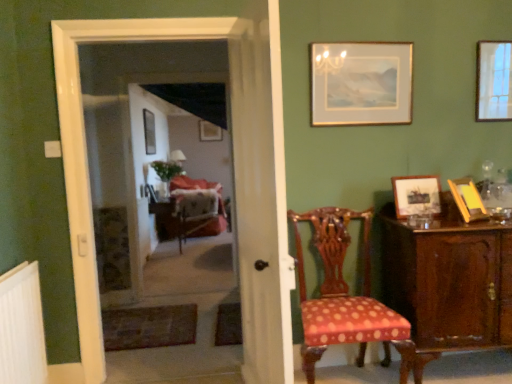
Question: Does metallic silver picture frame at center, which ranks as the 5th picture frame in front-to-back order, come behind matte gold picture frame at center, which appears as the fifth picture frame when viewed from the right?

Choices:
 (A) no
 (B) yes

Answer: (A)

Question: Is metallic silver picture frame at center, which ranks as the 5th picture frame in front-to-back order, facing away from matte gold picture frame at center, which appears as the fifth picture frame when viewed from the right?

Choices:
 (A) no
 (B) yes

Answer: (A)

Question: Can you confirm if metallic silver picture frame at center, which appears as the 6th picture frame when viewed from the right, is thinner than matte gold picture frame at center, placed as the second picture frame when sorted from left to right?

Choices:
 (A) no
 (B) yes

Answer: (A)

Question: Does metallic silver picture frame at center, which is counted as the first picture frame, starting from the left, have a lesser height compared to matte gold picture frame at center, positioned as the sixth picture frame in front-to-back order?

Choices:
 (A) no
 (B) yes

Answer: (A)

Question: Considering the relative sizes of metallic silver picture frame at center, which appears as the 6th picture frame when viewed from the right, and matte gold picture frame at center, which appears as the fifth picture frame when viewed from the right, in the image provided, is metallic silver picture frame at center, which appears as the 6th picture frame when viewed from the right, taller than matte gold picture frame at center, which appears as the fifth picture frame when viewed from the right,?

Choices:
 (A) no
 (B) yes

Answer: (B)

Question: From a real-world perspective, is metallic silver picture frame at center, which appears as the 6th picture frame when viewed from the right, physically below matte gold picture frame at center, placed as the second picture frame when sorted from left to right?

Choices:
 (A) no
 (B) yes

Answer: (B)

Question: Is white sheer curtain at center outside matte gold picture frame at center, placed as the second picture frame when sorted from left to right?

Choices:
 (A) yes
 (B) no

Answer: (A)

Question: Is white sheer curtain at center looking in the opposite direction of matte gold picture frame at center, placed as the second picture frame when sorted from left to right?

Choices:
 (A) no
 (B) yes

Answer: (A)

Question: Does white sheer curtain at center have a lesser width compared to matte gold picture frame at center, which appears as the fifth picture frame when viewed from the right?

Choices:
 (A) no
 (B) yes

Answer: (A)

Question: Could you tell me if white sheer curtain at center is turned towards matte gold picture frame at center, which appears as the fifth picture frame when viewed from the right?

Choices:
 (A) yes
 (B) no

Answer: (B)

Question: Is white sheer curtain at center bigger than matte gold picture frame at center, positioned as the sixth picture frame in front-to-back order?

Choices:
 (A) no
 (B) yes

Answer: (B)

Question: From a real-world perspective, is white sheer curtain at center physically above matte gold picture frame at center, the first picture frame viewed from the back?

Choices:
 (A) yes
 (B) no

Answer: (B)

Question: Considering the relative sizes of wooden picture frame at right, marked as the first picture frame in a front-to-back arrangement, and velvet upholstered armchair at center in the image provided, is wooden picture frame at right, marked as the first picture frame in a front-to-back arrangement, wider than velvet upholstered armchair at center?

Choices:
 (A) yes
 (B) no

Answer: (B)